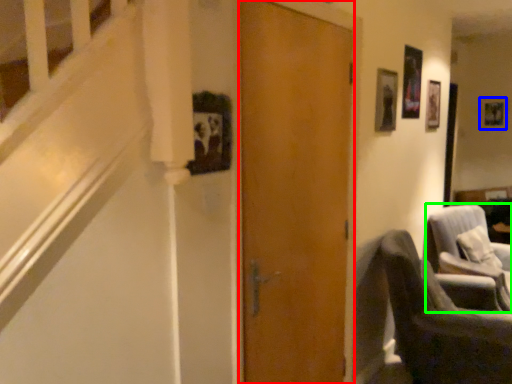
Question: Estimate the real-world distances between objects in this image. Which object is farther from door (highlighted by a red box), picture frame (highlighted by a blue box) or chair (highlighted by a green box)?

Choices:
 (A) picture frame
 (B) chair

Answer: (A)